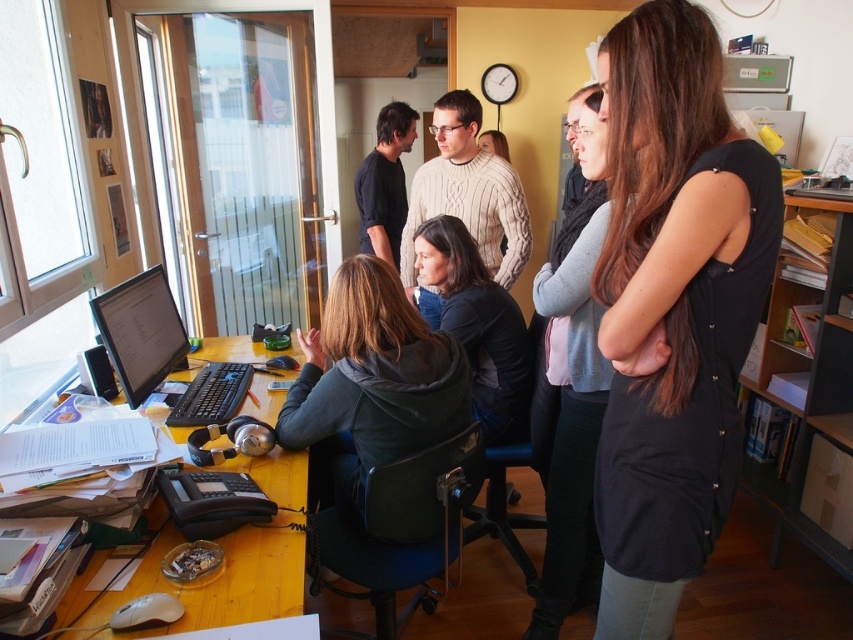
Looking at this image, can you confirm if black matte dress at right is bigger than yellow wood computer desk at lower left?

No, black matte dress at right is not bigger than yellow wood computer desk at lower left.

Who is positioned more to the right, black matte dress at right or yellow wood computer desk at lower left?

black matte dress at right is more to the right.

Is point (631, 324) positioned in front of point (108, 595)?

Yes, point (631, 324) is closer to viewer.

You are a GUI agent. You are given a task and a screenshot of the screen. Output one action in this format:
    pyautogui.click(x=<x>, y=<y>)
    Task: Click on the black matte dress at right
    Image resolution: width=853 pixels, height=640 pixels.
    Given the screenshot: What is the action you would take?
    pyautogui.click(x=672, y=307)

Can you confirm if black matte dress at right is taller than gray sweater at center?

Incorrect, black matte dress at right's height is not larger of gray sweater at center's.

Is black matte dress at right above gray sweater at center?

Yes.

At what (x,y) coordinates should I click in order to perform the action: click on black matte dress at right. Please return your answer as a coordinate pair (x, y). The height and width of the screenshot is (640, 853). Looking at the image, I should click on (672, 307).

The width and height of the screenshot is (853, 640). Describe the element at coordinates (479, 326) in the screenshot. I see `black matte jacket at center` at that location.

Can you confirm if black matte jacket at center is smaller than matte black monitor at left?

Incorrect, black matte jacket at center is not smaller in size than matte black monitor at left.

Find the location of a particular element. black matte jacket at center is located at coordinates (479, 326).

The image size is (853, 640). What are the coordinates of `black matte jacket at center` in the screenshot? It's located at (479, 326).